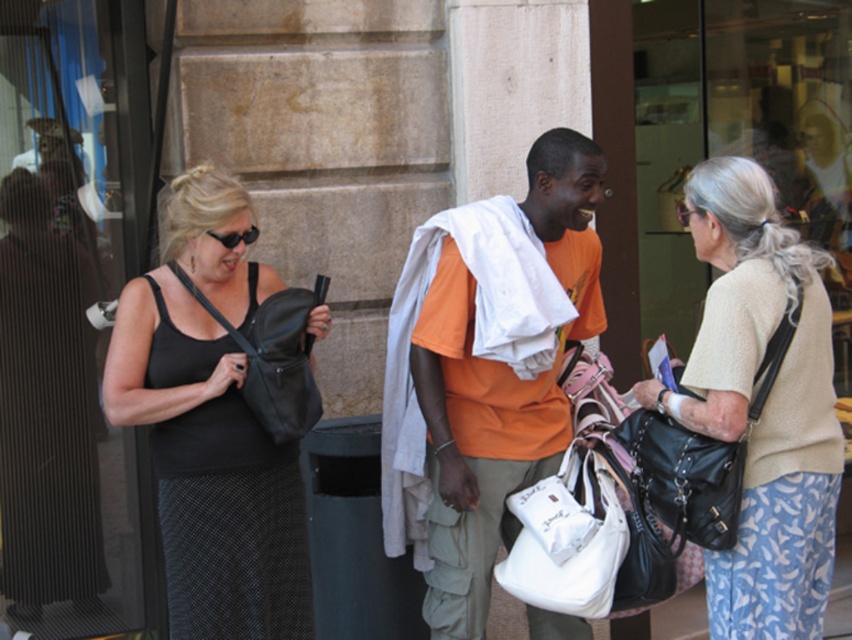
Question: Based on their relative distances, which object is nearer to the black leather bag at center?

Choices:
 (A) black plastic sunglasses at upper left
 (B) black fabric handbag at center
 (C) orange cotton shirt at center
 (D) black leather handbag at right

Answer: (B)

Question: Which of the following is the farthest from the observer?

Choices:
 (A) (438, 627)
 (B) (219, 236)
 (C) (268, 396)

Answer: (A)

Question: Is black fabric handbag at center wider than beige textured sweater at center?

Choices:
 (A) yes
 (B) no

Answer: (A)

Question: Which object is closer to the camera taking this photo?

Choices:
 (A) black plastic sunglasses at upper left
 (B) black fabric handbag at center
 (C) orange cotton shirt at center
 (D) beige textured sweater at center

Answer: (D)

Question: Considering the relative positions of beige textured sweater at center and orange cotton shirt at center in the image provided, where is beige textured sweater at center located with respect to orange cotton shirt at center?

Choices:
 (A) left
 (B) right

Answer: (B)

Question: Does orange cotton shirt at center appear under black leather handbag at right?

Choices:
 (A) yes
 (B) no

Answer: (A)